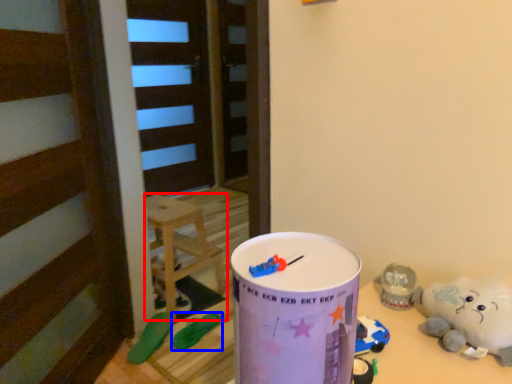
Question: Which point is further to the camera, furniture (highlighted by a red box) or toy (highlighted by a blue box)?

Choices:
 (A) furniture
 (B) toy

Answer: (A)